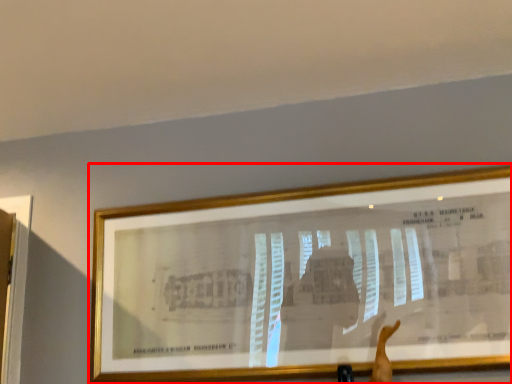
Question: From the image's perspective, where is picture frame (annotated by the red box) located in relation to arm in the image?

Choices:
 (A) below
 (B) above

Answer: (B)